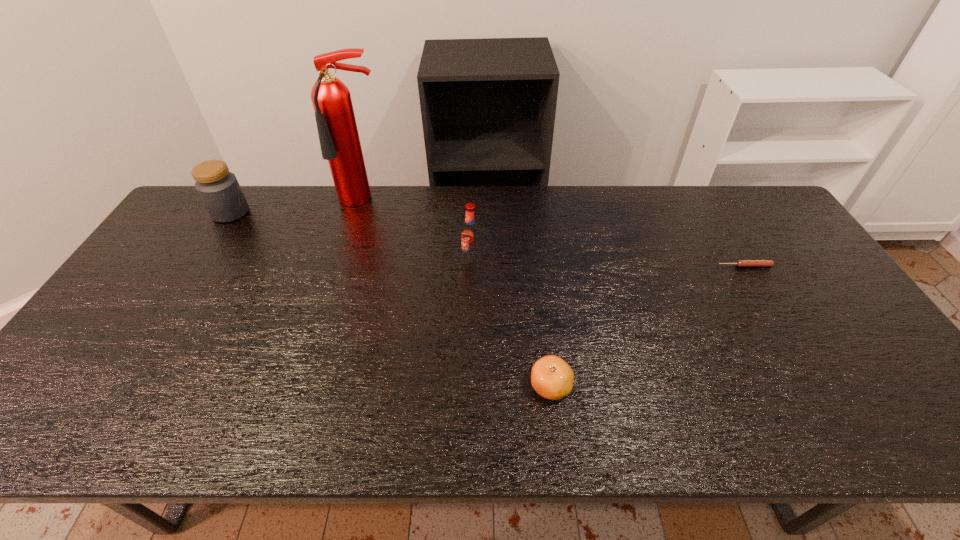
Where is `free space at the near edge of the desktop`? This screenshot has height=540, width=960. free space at the near edge of the desktop is located at coordinates (463, 434).

In the image, there is a desktop. Where is `vacant space at the left edge`? vacant space at the left edge is located at coordinates (162, 284).

In the image, there is a desktop. Where is `free space at the right edge`? This screenshot has width=960, height=540. free space at the right edge is located at coordinates (884, 378).

Locate an element on the screen. This screenshot has width=960, height=540. vacant space at the near left corner is located at coordinates (90, 414).

Where is `free space between the third object from left to right and the jar`? free space between the third object from left to right and the jar is located at coordinates (351, 236).

Find the location of a particular element. vacant space that's between the leftmost object and the shortest object is located at coordinates (488, 239).

Identify the location of empty location between the fire extinguisher and the leftmost object. The height and width of the screenshot is (540, 960). (298, 207).

I want to click on vacant point located between the tallest object and the fourth object from left to right, so click(x=457, y=294).

Locate an element on the screen. This screenshot has width=960, height=540. free space between the shortest object and the fire extinguisher is located at coordinates (555, 234).

The width and height of the screenshot is (960, 540). Find the location of `blank region between the second object from right to left and the jar`. blank region between the second object from right to left and the jar is located at coordinates (391, 299).